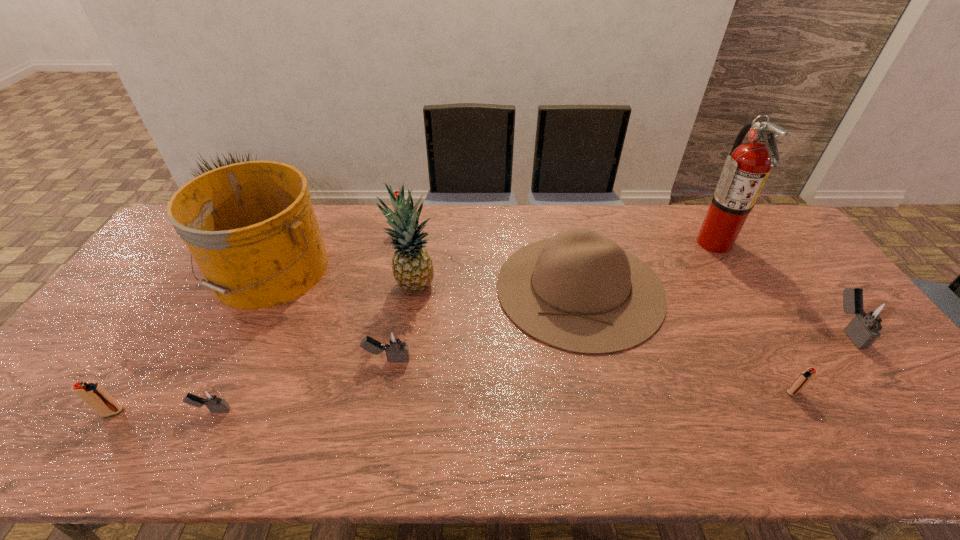
Find the location of `the rightmost object`. the rightmost object is located at coordinates (863, 329).

You are a GUI agent. You are given a task and a screenshot of the screen. Output one action in this format:
    pyautogui.click(x=<x>, y=<y>)
    Task: Click on the biggest gray igniter
    Image resolution: width=960 pixels, height=540 pixels.
    Given the screenshot: What is the action you would take?
    pyautogui.click(x=863, y=329)

Where is `the second biggest gray igniter`? the second biggest gray igniter is located at coordinates (394, 343).

Locate an element on the screen. This screenshot has height=540, width=960. the second smallest red igniter is located at coordinates (93, 394).

This screenshot has width=960, height=540. In order to click on the leftmost igniter in this screenshot , I will do `click(93, 394)`.

Find the location of a particular element. The width and height of the screenshot is (960, 540). the smallest red igniter is located at coordinates (809, 373).

At what (x,y) coordinates should I click in order to perform the action: click on the fifth igniter from left to right. Please return your answer as a coordinate pair (x, y). This screenshot has width=960, height=540. Looking at the image, I should click on (809, 373).

Find the location of `the leftmost gray igniter`. the leftmost gray igniter is located at coordinates (209, 396).

This screenshot has width=960, height=540. I want to click on the second igniter from left to right, so click(x=209, y=396).

Find the location of a particular element. vacant area located on the nozzle side of the tallest object is located at coordinates (592, 242).